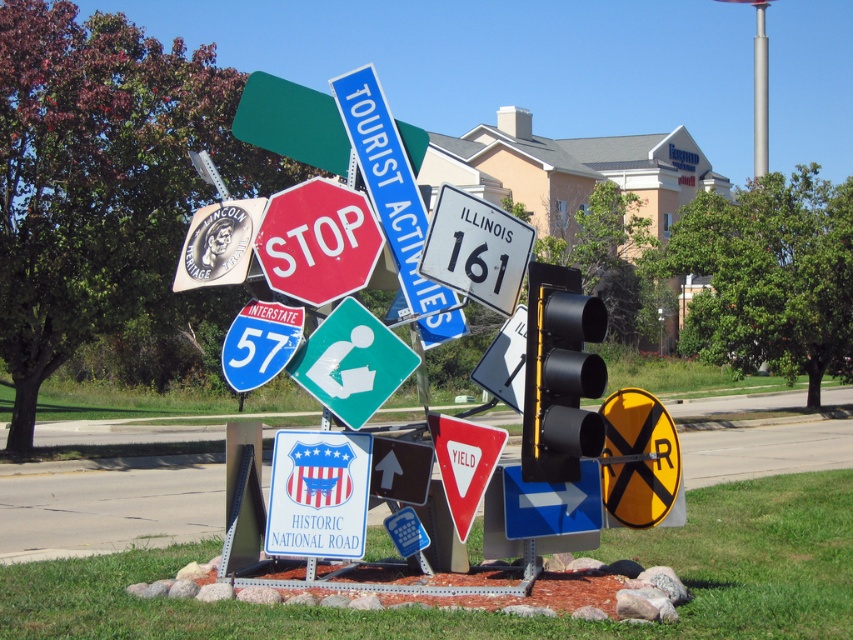
Question: Does black matte traffic light at center have a greater width compared to silver metallic pole at upper right?

Choices:
 (A) yes
 (B) no

Answer: (B)

Question: Which is farther from the black glossy arrow at center?

Choices:
 (A) black matte traffic light at center
 (B) green plastic information sign at center
 (C) green plastic sign at upper center

Answer: (C)

Question: Can you confirm if black matte traffic light at center is positioned below red/yellow plastic yield sign at center?

Choices:
 (A) yes
 (B) no

Answer: (B)

Question: Does metallic red stop sign at center have a greater width compared to red/yellow plastic yield sign at center?

Choices:
 (A) yes
 (B) no

Answer: (A)

Question: Which object appears closest to the camera in this image?

Choices:
 (A) red/yellow plastic yield sign at center
 (B) yellowmaterial/texture railroad crossing sign at lower right

Answer: (B)

Question: Estimate the real-world distances between objects in this image. Which object is farther from the blue plastic sign at center?

Choices:
 (A) blue glossy interstate 57 sign at left
 (B) silver metallic pole at upper right

Answer: (B)